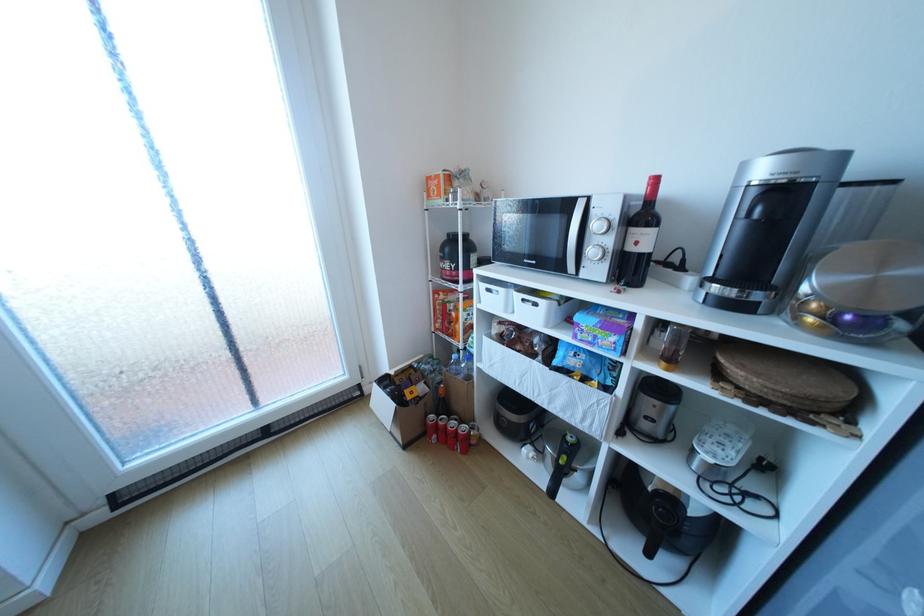
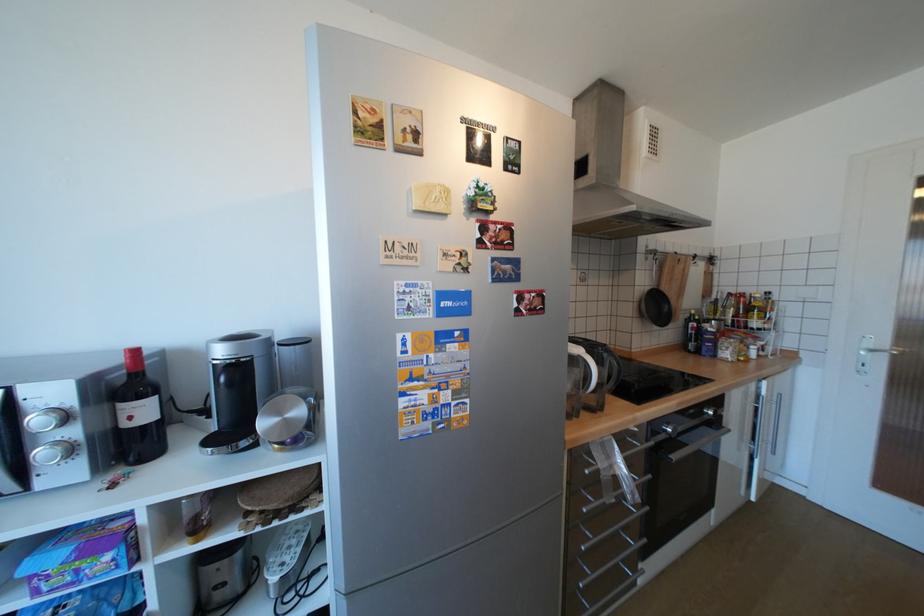
Where in the second image is the point corresponding to (603,225) from the first image?

(46, 419)